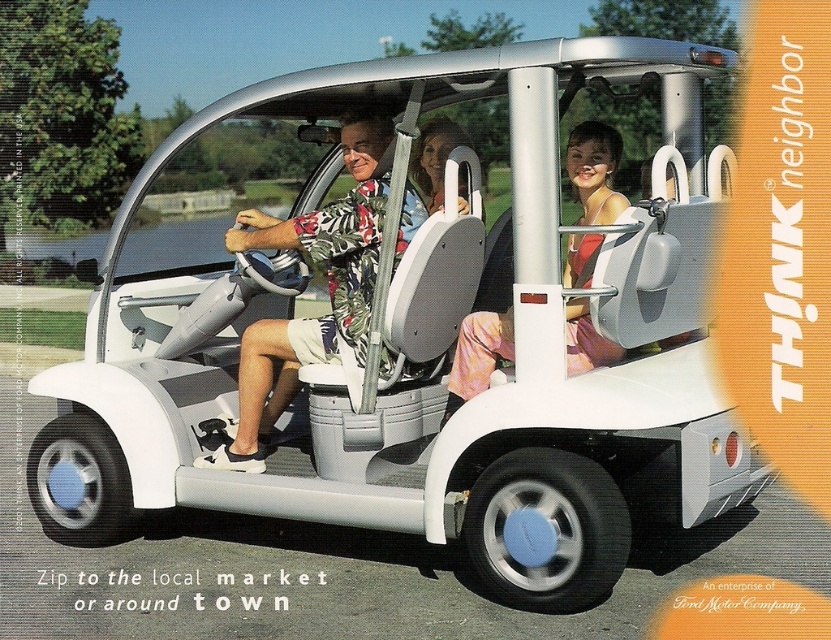
Looking at this image, you are a passenger sitting in the electric vehicle and looking at the two items inside. Which item is positioned lower between the floral fabric shirt at center and the pink fabric dress at center?

The floral fabric shirt at center is located below the pink fabric dress at center, so it is positioned lower.